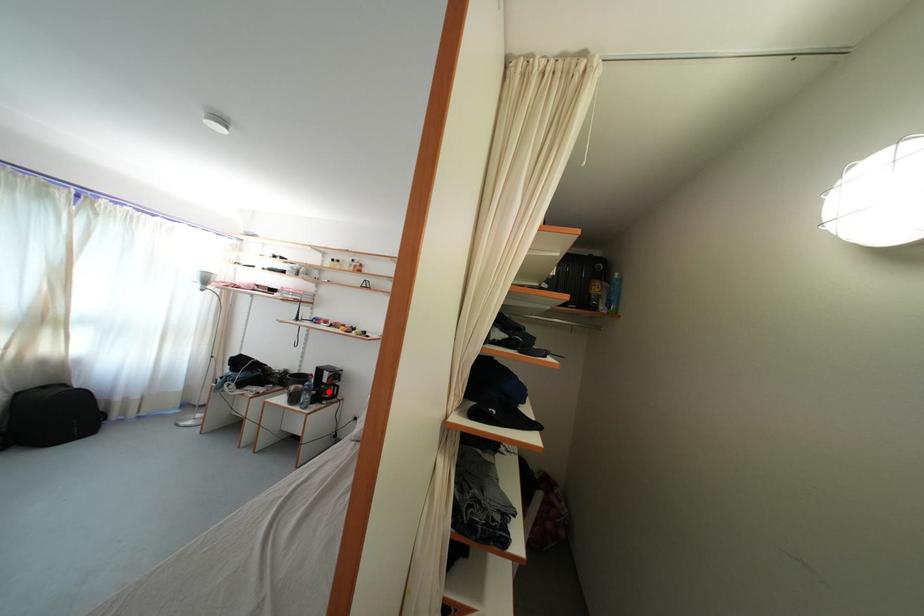
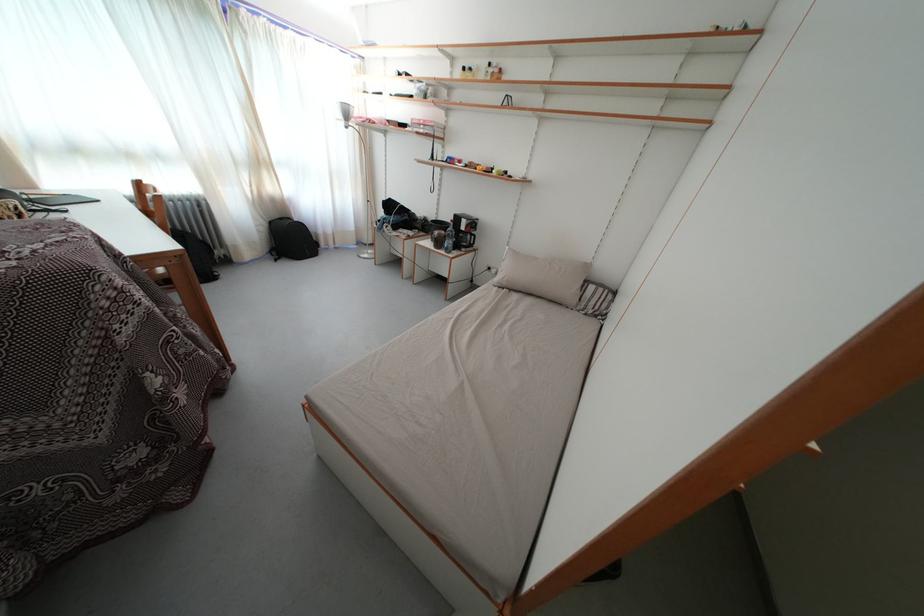
Question: I am providing you with two images of the same scene from different viewpoints. A red point is shown in image1. For the corresponding object point in image2, is it positioned nearer or farther from the camera?

Choices:
 (A) Nearer
 (B) Farther

Answer: (A)